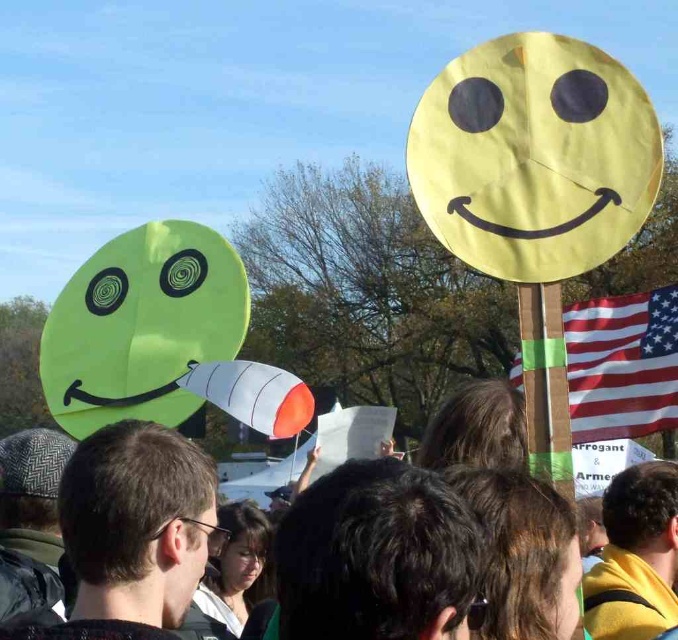
You are a photographer trying to capture both the matte green smiley face at upper left and the yellow fabric head at upper center in a single shot. However, your camera can only focus on objects that are at the same distance. Can you adjust your position so both objects are in focus without moving the signs?

The matte green smiley face at upper left is in front of the yellow fabric head at upper center, so they are at different distances. To have both in focus, you need to adjust your position so that both are at the same distance from the camera. Since the matte green smiley face at upper left is closer, moving back while keeping both in view might help achieve the desired focus.

You are a photographer trying to capture both the matte green smiley face at upper left and the smooth skin face at center in a single shot. Based on their sizes in the image, which one would appear larger in your photo?

The matte green smiley face at upper left appears larger in the photo because it is much taller than the smooth skin face at center.

You are standing in the crowd at the protest and see the two large circular signs. The green sign with the smiley face is to your left, and the yellow sign with the bigger smile is to your right. There is a point marked at coordinates (620, 364). Based on the scene, which object does this point belong to?

The point at coordinates (620, 364) is on the American flag at right.